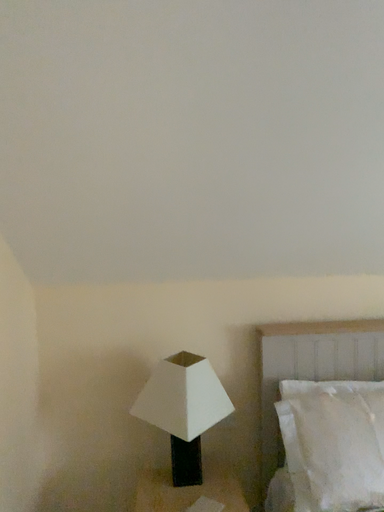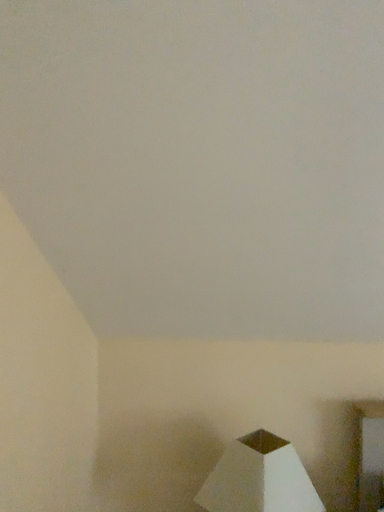
Question: How did the camera likely rotate when shooting the video?

Choices:
 (A) rotated left
 (B) rotated right

Answer: (A)